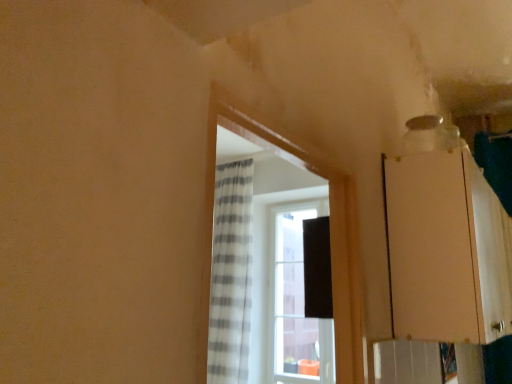
Question: In the image, is white striped curtain at center on the left side or the right side of matte wood cabinet at right?

Choices:
 (A) left
 (B) right

Answer: (A)

Question: Looking at the image, does white striped curtain at center seem bigger or smaller compared to matte wood cabinet at right?

Choices:
 (A) small
 (B) big

Answer: (A)

Question: In terms of width, does white striped curtain at center look wider or thinner when compared to matte wood cabinet at right?

Choices:
 (A) wide
 (B) thin

Answer: (B)

Question: From the image's perspective, relative to white striped curtain at center, is matte wood cabinet at right above or below?

Choices:
 (A) above
 (B) below

Answer: (B)

Question: In the image, is matte wood cabinet at right positioned in front of or behind white striped curtain at center?

Choices:
 (A) behind
 (B) front

Answer: (A)

Question: Looking at the image, does matte wood cabinet at right seem bigger or smaller compared to white striped curtain at center?

Choices:
 (A) big
 (B) small

Answer: (A)

Question: Would you say matte wood cabinet at right is to the left or to the right of white striped curtain at center in the picture?

Choices:
 (A) left
 (B) right

Answer: (B)